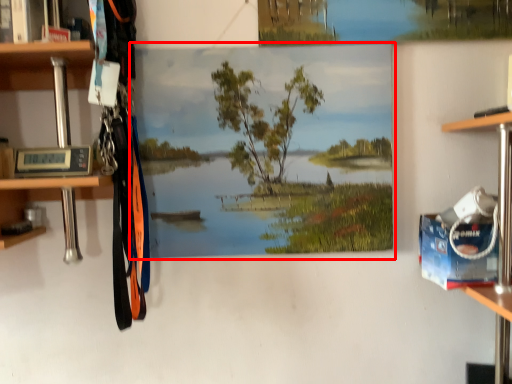
Question: From the image's perspective, what is the correct spatial relationship of oil painting (annotated by the red box) in relation to cabinet?

Choices:
 (A) above
 (B) below

Answer: (B)